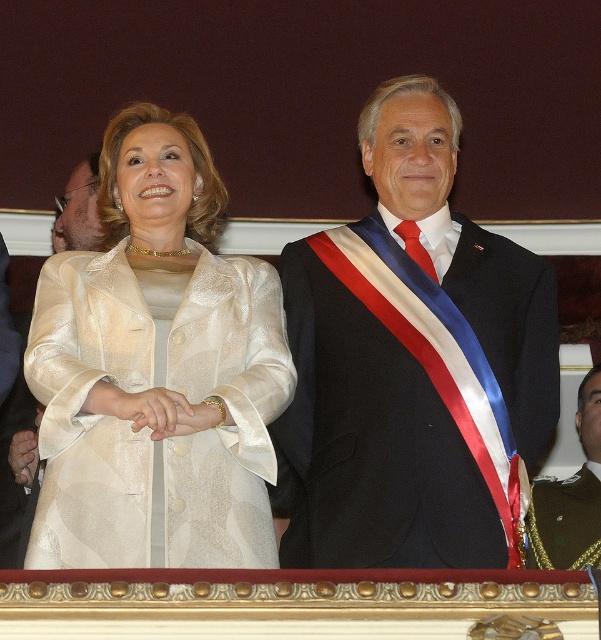
Consider the image. You are organizing a photo shoot and need to ensure that the shiny black suit at center and the ivory silk dress at center fit within a 1.5 meter wide frame. Based on their widths, will both items fit side by side without overlapping?

The shiny black suit at center is wider than the ivory silk dress at center. Since the total width of both items combined would exceed 1.5 meters, they cannot fit side by side without overlapping within the frame.

You are organizing a photo shoot and need to place two outfits on a rack. The shiny black suit at center and the green textured uniform at right must be displayed side by side. Which outfit requires a larger hanger?

The shiny black suit at center requires a larger hanger because it is larger in size than the green textured uniform at right.

You are organizing a photo shoot and need to place a backdrop that is 2 meters wide. The shiny black suit at center and the green textured uniform at right are positioned in front of it. Will the backdrop be wide enough to cover both outfits without any part of them being cut off?

The shiny black suit at center is wider than the green textured uniform at right. Since the backdrop is 2 meters wide, it should be sufficient to cover both outfits as long as they are positioned centrally and not spread too far apart.